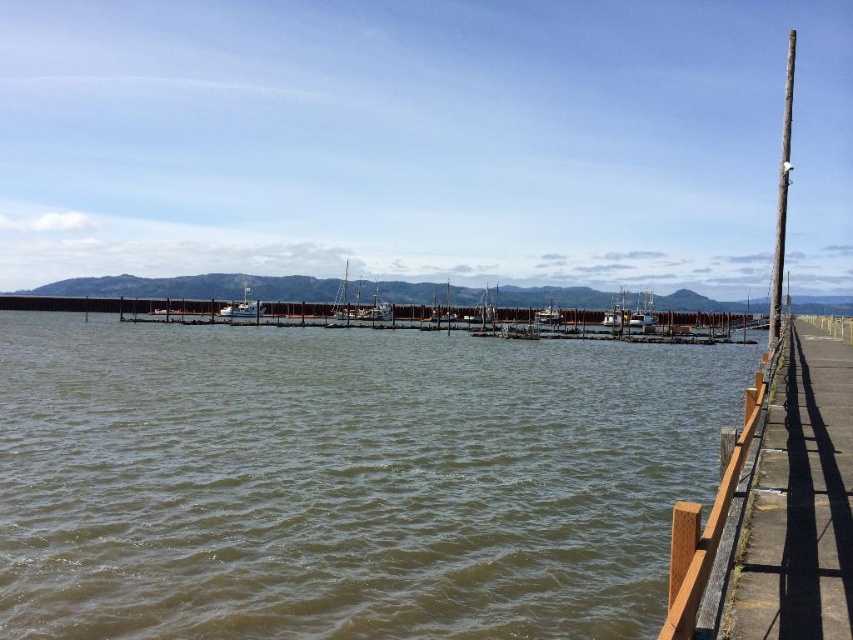
Looking at this image, you are an environmental inspector assessing the waterfront area. You need to determine which area requires more immediate attention based on their sizes. Which object between the brown water at center and the brown wooden dock at right should you prioritize for inspection?

The brown water at center is larger in size than the brown wooden dock at right, so you should prioritize inspecting the brown water at center first due to its larger area requiring attention.

You are a photographer positioned at the white wooden boat at center and want to take a photo of the dark brown wooden pole at right. Given that your camera has a maximum zoom range of 100 meters, will you be able to capture the pole clearly in your photo?

The dark brown wooden pole at right is 92.44 meters from the white wooden boat at center. Since the camera can zoom up to 100 meters, the distance is within the maximum range, so yes, you can capture the pole clearly.